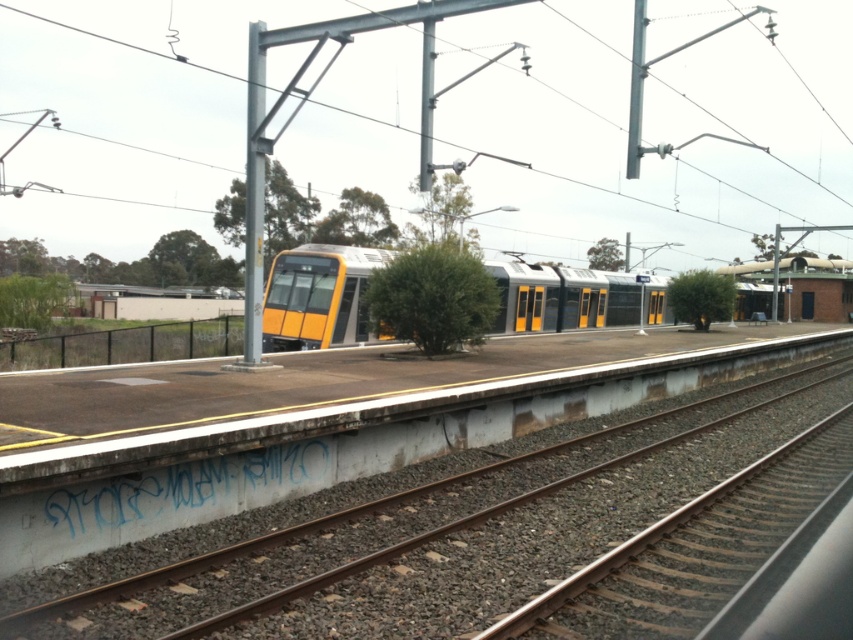
Is metallic gray power line at upper center positioned before smooth concrete track at center?

That is False.

Looking at this image, between metallic gray power line at upper center and smooth concrete track at center, which one is positioned higher?

Positioned higher is metallic gray power line at upper center.

Is point (664, 109) positioned behind point (405, 496)?

Yes, point (664, 109) is farther from viewer.

Image resolution: width=853 pixels, height=640 pixels. I want to click on metallic gray power line at upper center, so click(x=593, y=145).

I want to click on smooth concrete track at center, so click(456, 531).

Which of these two, smooth concrete track at center or yellow matte train at center, stands taller?

yellow matte train at center

Who is more forward, (440, 593) or (506, 305)?

Positioned in front is point (440, 593).

The height and width of the screenshot is (640, 853). Find the location of `smooth concrete track at center`. smooth concrete track at center is located at coordinates (456, 531).

Can you confirm if metallic gray power line at upper center is bigger than yellow matte train at center?

Yes, metallic gray power line at upper center is bigger than yellow matte train at center.

Can you confirm if metallic gray power line at upper center is positioned to the left of yellow matte train at center?

Indeed, metallic gray power line at upper center is positioned on the left side of yellow matte train at center.

Where is `metallic gray power line at upper center`? The width and height of the screenshot is (853, 640). metallic gray power line at upper center is located at coordinates (593, 145).